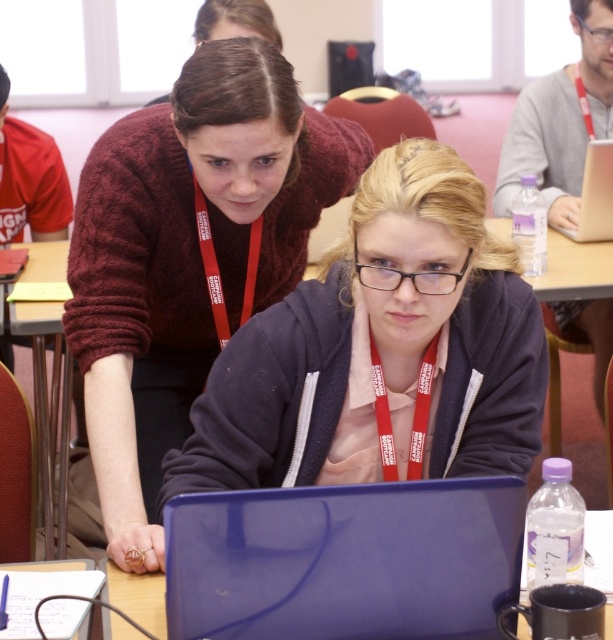
You are standing in the classroom and need to find the maroon knitted sweater at upper center. According to the coordinates provided, where should you look to locate it?

The maroon knitted sweater at upper center is located at point (188, 256), so you should look towards the upper center area of the image to find it.

You are standing in the classroom and want to reach a specific point marked at coordinates point (94, 346). If your current position is 3 feet away from that point, how much further do you need to move to reach it?

The distance of point (94, 346) from viewer is 4.82 feet. Since you are already 3 feet away, you need to move an additional 1.82 feet to reach it.